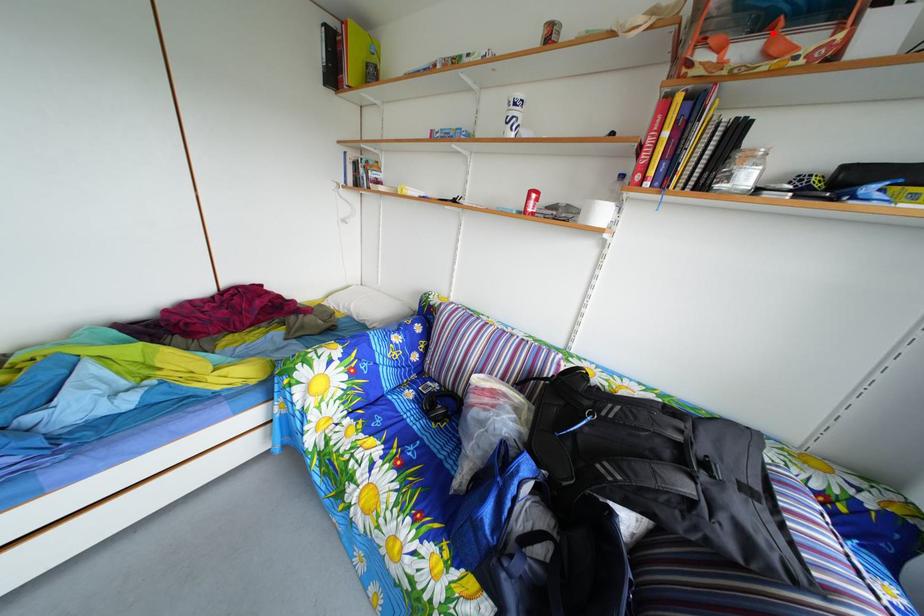
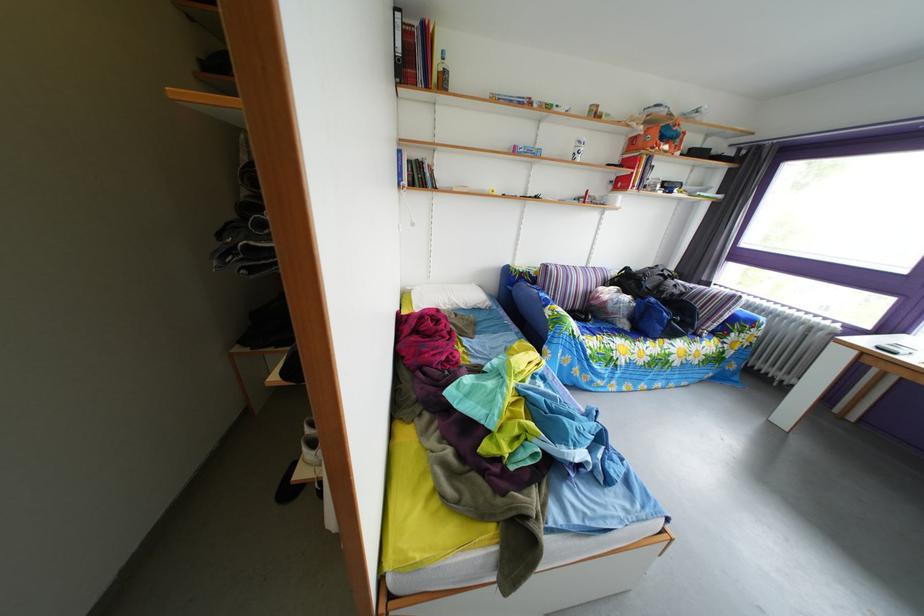
Question: I am providing you with two images of the same scene from different viewpoints. Image1 has a red point marked. In image2, the corresponding 3D location appears at what relative position? Reply with the corresponding letter.

Choices:
 (A) Closer
 (B) Farther

Answer: (A)